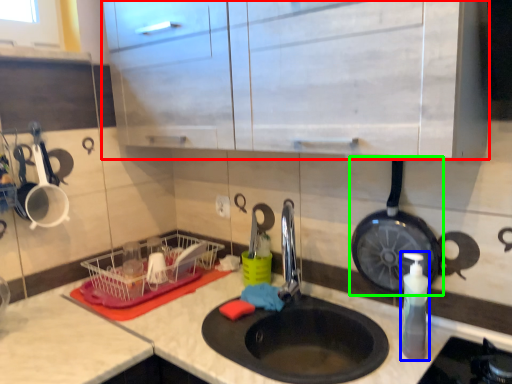
Question: Which object is the farthest from cabinetry (highlighted by a red box)? Choose among these: soap dispenser (highlighted by a blue box) or frying pan (highlighted by a green box).

Choices:
 (A) soap dispenser
 (B) frying pan

Answer: (A)